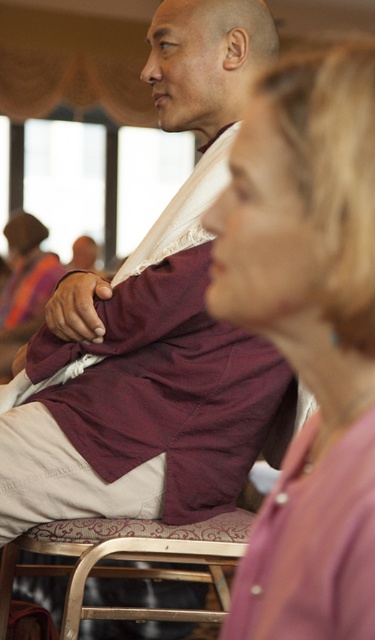
You are a photographer adjusting the camera focus. You notice two pink fabrics in the image, the pink fabric shirt at center and the pink fabric at lower right. Which one is closer to the camera?

The pink fabric shirt at center is closer to the camera since it is only 3.18 inches away from the pink fabric at lower right, which is further away.

You are organizing a clothing donation drive and need to determine which pink fabric item takes up more horizontal space. Which one is wider between the pink fabric shirt at center and the pink fabric at lower right?

The pink fabric shirt at center is wider than the pink fabric at lower right, so it takes up more horizontal space.

You are attending a cultural event and notice two pink fabrics in the image. The first is a pink fabric shirt at center and the second is pink fabric at lower right. Which one is positioned higher in the image?

The pink fabric shirt at center is positioned higher than the pink fabric at lower right.